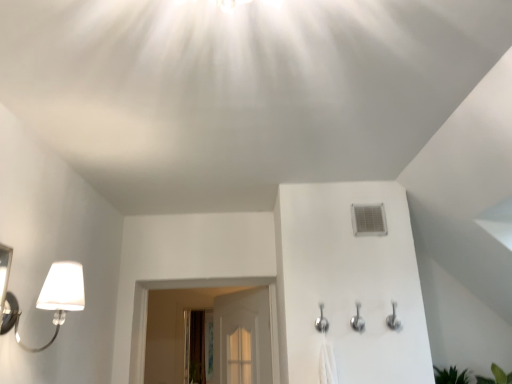
In order to face clear glass screen door at center, should I rotate leftwards or rightwards?

Rotate left and turn 7.590 degrees.

In order to click on white plastic air conditioner at upper right in this screenshot , I will do `click(369, 220)`.

In order to click on green leafy plant at lower right in this screenshot , I will do `click(450, 376)`.

Describe the element at coordinates (450, 376) in the screenshot. The height and width of the screenshot is (384, 512). I see `green leafy plant at lower right` at that location.

What do you see at coordinates (50, 299) in the screenshot? I see `white matte lamp at left` at bounding box center [50, 299].

The width and height of the screenshot is (512, 384). I want to click on clear glass screen door at center, so click(195, 349).

Does green leafy plant at lower right have a larger size compared to silver metallic shower head at center?

Yes.

Would you say green leafy plant at lower right is outside silver metallic shower head at center?

Absolutely, green leafy plant at lower right is external to silver metallic shower head at center.

From the image's perspective, does green leafy plant at lower right appear lower than silver metallic shower head at center?

Yes, from the image's perspective, green leafy plant at lower right is beneath silver metallic shower head at center.

Considering the relative sizes of white plastic air conditioner at upper right and green leafy plant at lower right in the image provided, is white plastic air conditioner at upper right taller than green leafy plant at lower right?

Yes, white plastic air conditioner at upper right is taller than green leafy plant at lower right.

Is white plastic air conditioner at upper right facing towards green leafy plant at lower right?

No, white plastic air conditioner at upper right is not oriented towards green leafy plant at lower right.

From a real-world perspective, which object stands above the other?

→ white plastic air conditioner at upper right is physically above.

Considering the relative sizes of white plastic air conditioner at upper right and green leafy plant at lower right in the image provided, is white plastic air conditioner at upper right wider than green leafy plant at lower right?

Incorrect, the width of white plastic air conditioner at upper right does not surpass that of green leafy plant at lower right.

Based on the photo, can you confirm if clear glass screen door at center is taller than silver metallic shower head at center?

Yes, clear glass screen door at center is taller than silver metallic shower head at center.

From a real-world perspective, is clear glass screen door at center positioned under silver metallic shower head at center based on gravity?

Yes, from a real-world perspective, clear glass screen door at center is beneath silver metallic shower head at center.

In terms of width, does clear glass screen door at center look wider or thinner when compared to silver metallic shower head at center?

In the image, clear glass screen door at center appears to be wider than silver metallic shower head at center.

From the picture: Looking at their sizes, would you say silver metallic shower head at center is wider or thinner than clear glass screen door at center?

In the image, silver metallic shower head at center appears to be more narrow than clear glass screen door at center.

From a real-world perspective, which object rests below the other?

clear glass screen door at center, from a real-world perspective.

Is silver metallic shower head at center not near clear glass screen door at center?

Yes.

Which object is positioned more to the right, silver metallic shower head at center or clear glass screen door at center?

silver metallic shower head at center.

Locate an element on the screen. plant in front of the clear glass screen door at center is located at coordinates (450, 376).

Could you tell me if clear glass screen door at center is turned towards green leafy plant at lower right?

No, clear glass screen door at center is not oriented towards green leafy plant at lower right.

Is the position of clear glass screen door at center more distant than that of green leafy plant at lower right?

Yes, clear glass screen door at center is further from the viewer.

In the scene shown: Is clear glass screen door at center wider or thinner than green leafy plant at lower right?

Considering their sizes, clear glass screen door at center looks broader than green leafy plant at lower right.

Is green leafy plant at lower right next to white plastic air conditioner at upper right?

green leafy plant at lower right is not next to white plastic air conditioner at upper right, and they're not touching.

Can you confirm if green leafy plant at lower right is taller than white plastic air conditioner at upper right?

In fact, green leafy plant at lower right may be shorter than white plastic air conditioner at upper right.

Is green leafy plant at lower right positioned with its back to white plastic air conditioner at upper right?

green leafy plant at lower right does not have its back to white plastic air conditioner at upper right.

Consider the image. Is silver metallic shower head at center at the back of white matte lamp at left?

No, white matte lamp at left is not facing the opposite direction of silver metallic shower head at center.

Is white matte lamp at left touching silver metallic shower head at center?

No, white matte lamp at left is not beside silver metallic shower head at center.

From a real-world perspective, is white matte lamp at left positioned above or below silver metallic shower head at center?

white matte lamp at left is situated higher than silver metallic shower head at center in the real world.

Is white matte lamp at left completely or partially outside of silver metallic shower head at center?

Yes, white matte lamp at left is not within silver metallic shower head at center.

Locate an element on the screen. This screenshot has height=384, width=512. plant that is on the right side of silver metallic shower head at center is located at coordinates (450, 376).

The image size is (512, 384). What are the coordinates of `plant below the white plastic air conditioner at upper right (from the image's perspective)` in the screenshot? It's located at (450, 376).

Which object lies nearer to the anchor point clear glass screen door at center, white plastic air conditioner at upper right or green leafy plant at lower right?

green leafy plant at lower right.

From the image, which object appears to be farther from green leafy plant at lower right, white matte lamp at left or silver metallic shower head at center?

white matte lamp at left is positioned further to the anchor green leafy plant at lower right.

Estimate the real-world distances between objects in this image. Which object is closer to clear glass screen door at center, white matte lamp at left or silver metallic shower head at center?

Based on the image, silver metallic shower head at center appears to be nearer to clear glass screen door at center.

When comparing their distances from green leafy plant at lower right, does silver metallic shower head at center or clear glass screen door at center seem further?

clear glass screen door at center lies further to green leafy plant at lower right than the other object.

Based on their spatial positions, is white matte lamp at left or green leafy plant at lower right closer to silver metallic shower head at center?

green leafy plant at lower right is positioned closer to the anchor silver metallic shower head at center.

When comparing their distances from white matte lamp at left, does white plastic air conditioner at upper right or silver metallic shower head at center seem further?

white plastic air conditioner at upper right lies further to white matte lamp at left than the other object.

Considering their positions, is silver metallic shower head at center positioned closer to green leafy plant at lower right than white plastic air conditioner at upper right?

silver metallic shower head at center is closer to green leafy plant at lower right.

Looking at the image, which one is located further to white matte lamp at left, clear glass screen door at center or green leafy plant at lower right?

clear glass screen door at center lies further to white matte lamp at left than the other object.

Locate an element on the screen. air conditioner between silver metallic shower head at center and clear glass screen door at center along the z-axis is located at coordinates (369, 220).

Locate an element on the screen. The height and width of the screenshot is (384, 512). air conditioner between silver metallic shower head at center and green leafy plant at lower right from left to right is located at coordinates coord(369,220).

Where is `plant positioned between white matte lamp at left and clear glass screen door at center from near to far`? The image size is (512, 384). plant positioned between white matte lamp at left and clear glass screen door at center from near to far is located at coordinates (450, 376).

You are a GUI agent. You are given a task and a screenshot of the screen. Output one action in this format:
    pyautogui.click(x=<x>, y=<y>)
    Task: Click on the shower between white matte lamp at left and green leafy plant at lower right from left to right
    The width and height of the screenshot is (512, 384).
    Given the screenshot: What is the action you would take?
    pyautogui.click(x=321, y=321)